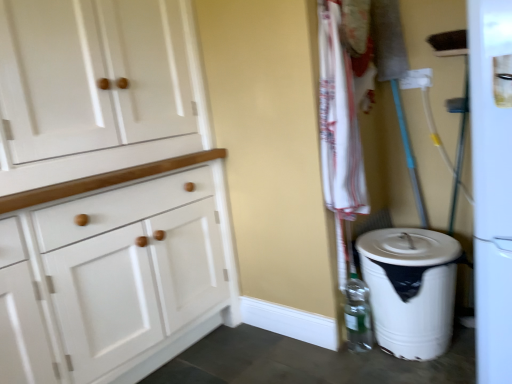
Question: Is white cotton towel at center-right turned away from clear plastic bottle at lower right?

Choices:
 (A) no
 (B) yes

Answer: (A)

Question: From a real-world perspective, is white cotton towel at center-right on top of clear plastic bottle at lower right?

Choices:
 (A) no
 (B) yes

Answer: (B)

Question: Can clear plastic bottle at lower right be found inside white cotton towel at center-right?

Choices:
 (A) yes
 (B) no

Answer: (B)

Question: Is white cotton towel at center-right far from clear plastic bottle at lower right?

Choices:
 (A) no
 (B) yes

Answer: (A)

Question: Is white cotton towel at center-right located outside clear plastic bottle at lower right?

Choices:
 (A) yes
 (B) no

Answer: (A)

Question: In terms of height, does clear plastic bottle at lower right look taller or shorter compared to white cotton towel at center-right?

Choices:
 (A) short
 (B) tall

Answer: (A)

Question: Is clear plastic bottle at lower right wider or thinner than white cotton towel at center-right?

Choices:
 (A) wide
 (B) thin

Answer: (B)

Question: From a real-world perspective, is clear plastic bottle at lower right physically located above or below white cotton towel at center-right?

Choices:
 (A) below
 (B) above

Answer: (A)

Question: Is clear plastic bottle at lower right inside or outside of white cotton towel at center-right?

Choices:
 (A) inside
 (B) outside

Answer: (B)

Question: From the image's perspective, is clear plastic bottle at lower right located above or below white plastic trash can at lower right?

Choices:
 (A) below
 (B) above

Answer: (A)

Question: Is clear plastic bottle at lower right wider or thinner than white plastic trash can at lower right?

Choices:
 (A) thin
 (B) wide

Answer: (A)

Question: In terms of size, does clear plastic bottle at lower right appear bigger or smaller than white plastic trash can at lower right?

Choices:
 (A) small
 (B) big

Answer: (A)

Question: Is clear plastic bottle at lower right inside or outside of white plastic trash can at lower right?

Choices:
 (A) outside
 (B) inside

Answer: (B)

Question: In the image, is white cotton towel at center-right positioned in front of or behind clear plastic bottle at lower right?

Choices:
 (A) front
 (B) behind

Answer: (A)

Question: In terms of width, does white cotton towel at center-right look wider or thinner when compared to clear plastic bottle at lower right?

Choices:
 (A) wide
 (B) thin

Answer: (A)